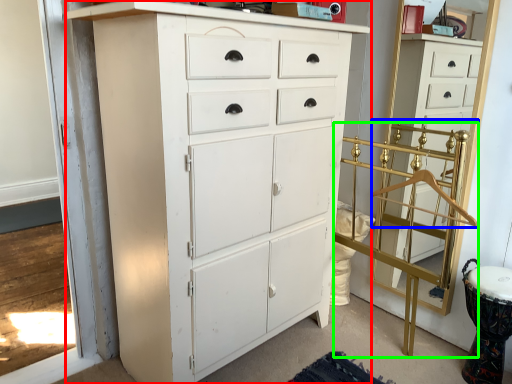
Question: Estimate the real-world distances between objects in this image. Which object is farther from chest of drawers (highlighted by a red box), hanger (highlighted by a blue box) or bunk bed (highlighted by a green box)?

Choices:
 (A) hanger
 (B) bunk bed

Answer: (A)